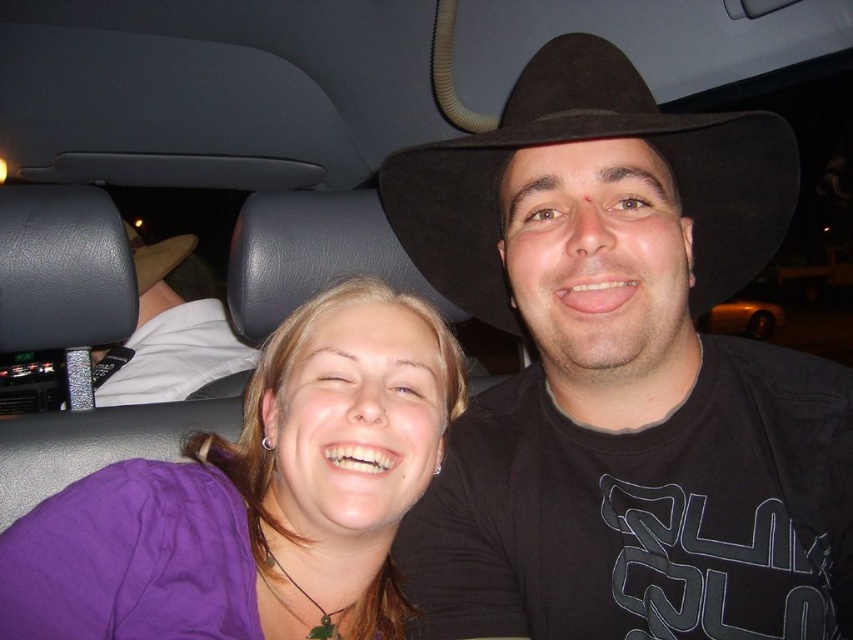
At what (x,y) coordinates should I click in order to perform the action: click on white fabric shirt at upper left. Please return your answer as a coordinate pair (x, y). Looking at the image, I should click on (167, 337).

Is point (160, 358) less distant than point (132, 228)?

Yes, it is in front of point (132, 228).

This screenshot has height=640, width=853. I want to click on white fabric shirt at upper left, so [167, 337].

In the scene shown: Is black felt fedora at center thinner than white fabric shirt at upper left?

Correct, black felt fedora at center's width is less than white fabric shirt at upper left's.

Is point (596, 138) in front of point (126, 339)?

Yes, point (596, 138) is closer to viewer.

At what (x,y) coordinates should I click in order to perform the action: click on black felt fedora at center. Please return your answer as a coordinate pair (x, y). The height and width of the screenshot is (640, 853). Looking at the image, I should click on (592, 140).

Looking at this image, between black felt hat at upper right and purple fabric shirt at center, which one appears on the right side from the viewer's perspective?

black felt hat at upper right

Image resolution: width=853 pixels, height=640 pixels. What do you see at coordinates (622, 376) in the screenshot? I see `black felt hat at upper right` at bounding box center [622, 376].

At what (x,y) coordinates should I click in order to perform the action: click on black felt hat at upper right. Please return your answer as a coordinate pair (x, y). This screenshot has height=640, width=853. Looking at the image, I should click on (622, 376).